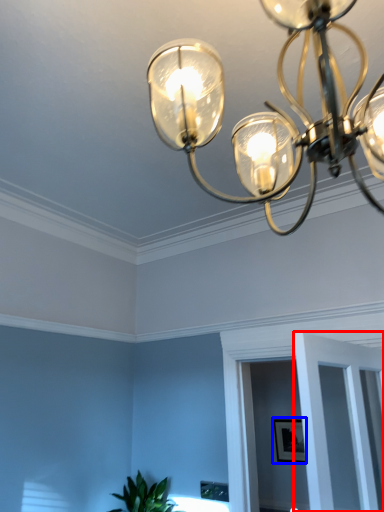
Question: Which object appears farthest to the camera in this image, glass door (highlighted by a red box) or picture frame (highlighted by a blue box)?

Choices:
 (A) glass door
 (B) picture frame

Answer: (B)